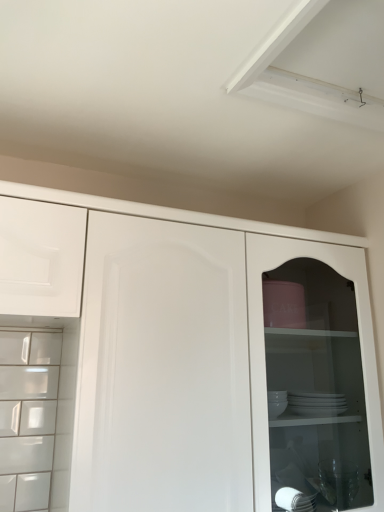
Locate an element on the screen. white matte drawer at upper left is located at coordinates (41, 258).

Measure the distance between white matte drawer at upper left and camera.

1.05 meters.

Describe the element at coordinates (41, 258) in the screenshot. I see `white matte drawer at upper left` at that location.

In order to face white matte drawer at upper left, should I rotate leftwards or rightwards?

Rotate left and turn 20.342 degrees.

In order to click on white glossy cupboard at center in this screenshot , I will do `click(261, 304)`.

What do you see at coordinates (261, 304) in the screenshot?
I see `white glossy cupboard at center` at bounding box center [261, 304].

The image size is (384, 512). Identify the location of white matte drawer at upper left. (41, 258).

Is white matte drawer at upper left at the right side of white glossy cupboard at center?

Incorrect, white matte drawer at upper left is not on the right side of white glossy cupboard at center.

Between white matte drawer at upper left and white glossy cupboard at center, which one is positioned behind?

white matte drawer at upper left is behind.

Which is less distant, [19,238] or [255,420]?

Point [19,238] appears to be closer to the viewer than point [255,420].

From the image's perspective, which one is positioned higher, white matte drawer at upper left or white glossy cupboard at center?

From the image's view, white matte drawer at upper left is above.

From a real-world perspective, relative to white glossy cupboard at center, is white matte drawer at upper left vertically above or below?

Clearly, from a real-world perspective, white matte drawer at upper left is above white glossy cupboard at center.

Is white matte drawer at upper left wider or thinner than white glossy cupboard at center?

white matte drawer at upper left is thinner than white glossy cupboard at center.

In the scene shown: Does white matte drawer at upper left have a greater height compared to white glossy cupboard at center?

No.

Considering the sizes of objects white matte drawer at upper left and white glossy cupboard at center in the image provided, who is bigger, white matte drawer at upper left or white glossy cupboard at center?

Bigger between the two is white glossy cupboard at center.

Is white matte drawer at upper left located outside white glossy cupboard at center?

Yes.

Are white matte drawer at upper left and white glossy cupboard at center located far from each other?

They are positioned close to each other.

Could you tell me if white matte drawer at upper left is facing white glossy cupboard at center?

No, white matte drawer at upper left is not oriented towards white glossy cupboard at center.

Can you tell me how much white matte drawer at upper left and white glossy cupboard at center differ in facing direction?

The angular difference between white matte drawer at upper left and white glossy cupboard at center is 0.000131 degrees.

Measure the distance between white matte drawer at upper left and white glossy cupboard at center.

The distance of white matte drawer at upper left from white glossy cupboard at center is 10.73 inches.

At what (x,y) coordinates should I click in order to perform the action: click on drawer that is behind the white glossy cupboard at center. Please return your answer as a coordinate pair (x, y). Looking at the image, I should click on (41, 258).

Between white glossy cupboard at center and white matte drawer at upper left, which one appears on the right side from the viewer's perspective?

white glossy cupboard at center.

Which object is closer to the camera, white glossy cupboard at center or white matte drawer at upper left?

white glossy cupboard at center is closer to the camera.

Is point (344, 263) positioned behind point (51, 270)?

Yes, point (344, 263) is farther from viewer.

From the image's perspective, is white glossy cupboard at center located beneath white matte drawer at upper left?

Yes.

In the scene shown: From a real-world perspective, does white glossy cupboard at center sit lower than white matte drawer at upper left?

Yes, from a real-world perspective, white glossy cupboard at center is beneath white matte drawer at upper left.

Considering the sizes of objects white glossy cupboard at center and white matte drawer at upper left in the image provided, who is wider, white glossy cupboard at center or white matte drawer at upper left?

white glossy cupboard at center is wider.

Considering the relative sizes of white glossy cupboard at center and white matte drawer at upper left in the image provided, is white glossy cupboard at center taller than white matte drawer at upper left?

Indeed, white glossy cupboard at center has a greater height compared to white matte drawer at upper left.

Does white glossy cupboard at center have a larger size compared to white matte drawer at upper left?

Yes.

Could white matte drawer at upper left be considered to be inside white glossy cupboard at center?

No, white matte drawer at upper left is not inside white glossy cupboard at center.

Is white glossy cupboard at center positioned far away from white matte drawer at upper left?

No, white glossy cupboard at center is not far from white matte drawer at upper left.

Consider the image. Is white glossy cupboard at center aimed at white matte drawer at upper left?

No, white glossy cupboard at center is not aimed at white matte drawer at upper left.

Locate an element on the screen. cupboard that is on the right side of white matte drawer at upper left is located at coordinates (261, 304).

In order to click on drawer behind the white glossy cupboard at center in this screenshot , I will do `click(41, 258)`.

Where is `cupboard below the white matte drawer at upper left (from a real-world perspective)`? Image resolution: width=384 pixels, height=512 pixels. cupboard below the white matte drawer at upper left (from a real-world perspective) is located at coordinates (261, 304).